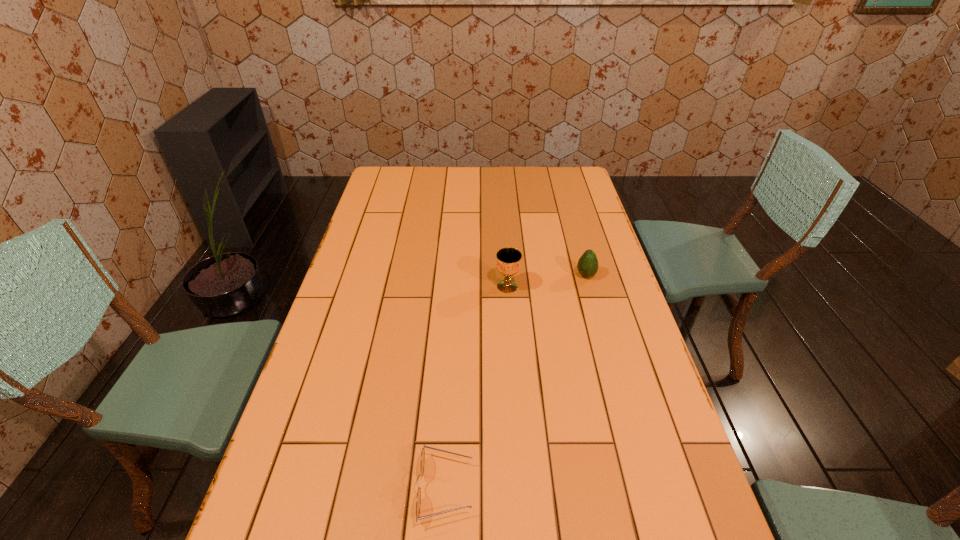
The width and height of the screenshot is (960, 540). Find the location of `vacant space at the far edge of the desktop`. vacant space at the far edge of the desktop is located at coordinates (423, 170).

At what (x,y) coordinates should I click in order to perform the action: click on vacant space at the left edge. Please return your answer as a coordinate pair (x, y). Looking at the image, I should click on (327, 494).

This screenshot has height=540, width=960. Identify the location of vacant region at the right edge. (617, 437).

Identify the location of vacant space at the far right corner. This screenshot has height=540, width=960. (570, 178).

Where is `free space between the second shortest object and the second object from right to left`? Image resolution: width=960 pixels, height=540 pixels. free space between the second shortest object and the second object from right to left is located at coordinates [546, 281].

I want to click on empty space that is in between the rightmost object and the leftmost object, so click(516, 382).

The width and height of the screenshot is (960, 540). I want to click on free area in between the chalice and the spectacles, so click(476, 387).

This screenshot has height=540, width=960. I want to click on unoccupied area between the nearest object and the second tallest object, so [516, 382].

Locate an element on the screen. The image size is (960, 540). unoccupied position between the chalice and the rightmost object is located at coordinates (546, 281).

Identify the location of empty space between the nearest object and the second tallest object. (516, 382).